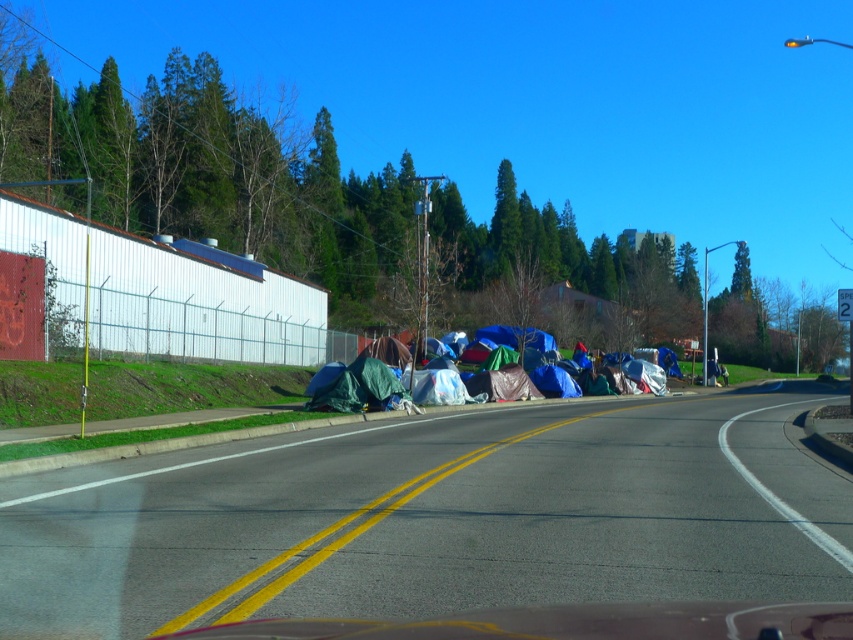
Between point (67, 509) and point (505, 381), which one is positioned behind?

Point (505, 381)

Can you confirm if asphalt road at lower center is positioned to the left of multicolored tarpaulin tents at center?

No, asphalt road at lower center is not to the left of multicolored tarpaulin tents at center.

Which is behind, point (630, 541) or point (389, 387)?

The point (389, 387) is more distant.

Locate an element on the screen. This screenshot has width=853, height=640. asphalt road at lower center is located at coordinates (437, 518).